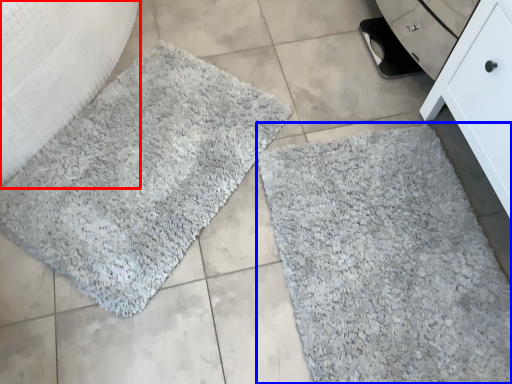
Question: Which of the following is the farthest to the observer, granite (highlighted by a red box) or bath mat (highlighted by a blue box)?

Choices:
 (A) granite
 (B) bath mat

Answer: (B)